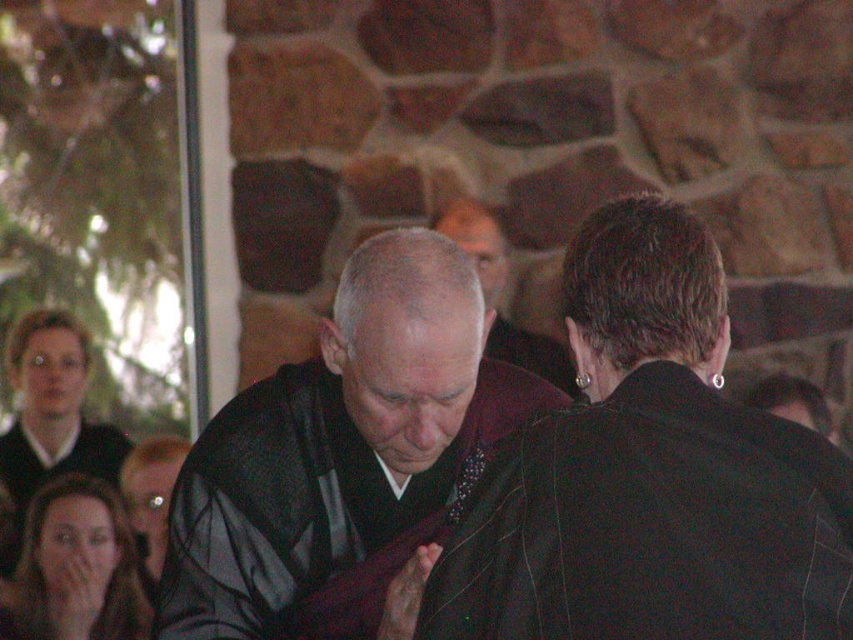
You are organizing a photo shoot and need to place a 1.2 meter wide backdrop behind the dark brown leather robe at center and the dark gray robe at center. Based on their widths, will the backdrop be sufficient to cover both robes without any overlap?

The dark brown leather robe at center might be wider than dark gray robe at center, so the total width required to cover both could exceed 1.2 meters. The backdrop may not be sufficient if the combined width of both robes is greater than the backdrop.

You are a photographer at this event and want to ensure both the dark brown leather robe at center and the black silk robe at center are clearly visible in your photo. Which robe should you focus on first to ensure it doesn t get cropped out?

The dark brown leather robe at center has a smaller size compared to black silk robe at center, so you should focus on the smaller dark brown leather robe at center first to ensure it doesn t get cropped out.